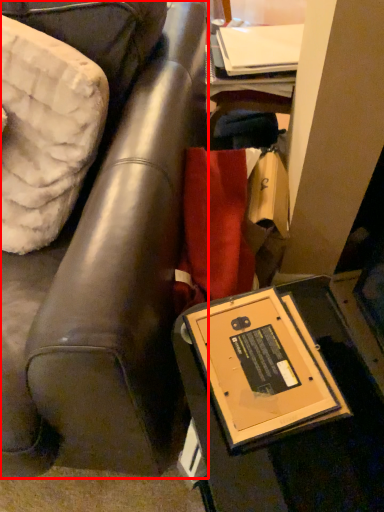
Question: In this image, where is furniture (annotated by the red box) located relative to table?

Choices:
 (A) right
 (B) left

Answer: (B)